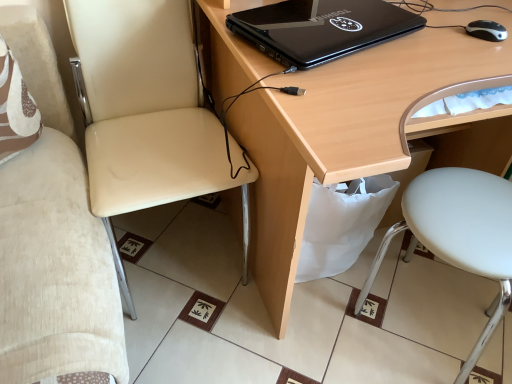
What are the coordinates of `black matte laptop at upper center` in the screenshot? It's located at (322, 29).

Where is `white matte stool at lower right, the 1th chair from the right`? The height and width of the screenshot is (384, 512). white matte stool at lower right, the 1th chair from the right is located at coordinates click(x=459, y=234).

Image resolution: width=512 pixels, height=384 pixels. I want to click on black plastic mouse at right, so click(486, 30).

You are a GUI agent. You are given a task and a screenshot of the screen. Output one action in this format:
    pyautogui.click(x=<x>, y=<y>)
    Task: Click on the black matte laptop at upper center
    
    Given the screenshot: What is the action you would take?
    pyautogui.click(x=322, y=29)

Considering the positions of objects black matte laptop at upper center and black plastic mouse at right in the image provided, who is more to the left, black matte laptop at upper center or black plastic mouse at right?

From the viewer's perspective, black matte laptop at upper center appears more on the left side.

Is black plastic mouse at right at the back of black matte laptop at upper center?

No, black matte laptop at upper center is not facing the opposite direction of black plastic mouse at right.

From the image's perspective, is black matte laptop at upper center located above or below black plastic mouse at right?

Clearly, from the image's perspective, black matte laptop at upper center is above black plastic mouse at right.

Looking at this image, between black matte laptop at upper center and black plastic mouse at right, which one is positioned behind?

black plastic mouse at right is behind.

In the scene shown: Is black matte laptop at upper center smaller than light wood desk at center?

Indeed, black matte laptop at upper center has a smaller size compared to light wood desk at center.

Is black matte laptop at upper center beside light wood desk at center?

They are not placed beside each other.

From a real-world perspective, is black matte laptop at upper center physically located above or below light wood desk at center?

black matte laptop at upper center is situated higher than light wood desk at center in the real world.

Is white matte stool at lower right, the 1th chair from the right, smaller than beige leather chair at left, which is the 2th chair in right-to-left order?

Yes.

What's the angular difference between white matte stool at lower right, which is the 2th chair from left to right, and beige leather chair at left, which is the first chair from left to right,'s facing directions?

There is a 3.69-degree angle between the facing directions of white matte stool at lower right, which is the 2th chair from left to right, and beige leather chair at left, which is the first chair from left to right.

From the image's perspective, is white matte stool at lower right, the 1th chair from the right, on beige leather chair at left, which is the first chair from left to right?

No, from the image's perspective, white matte stool at lower right, the 1th chair from the right, is not above beige leather chair at left, which is the first chair from left to right.

Is white matte stool at lower right, the 1th chair from the right, taller than beige leather chair at left, which is the 2th chair in right-to-left order?

No, white matte stool at lower right, the 1th chair from the right, is not taller than beige leather chair at left, which is the 2th chair in right-to-left order.

What are the coordinates of `desk in front of the black plastic mouse at right` in the screenshot? It's located at (361, 132).

Is light wood desk at center at the back of black plastic mouse at right?

Yes, black plastic mouse at right's orientation is away from light wood desk at center.

Is black plastic mouse at right inside the boundaries of light wood desk at center, or outside?

black plastic mouse at right can be found inside light wood desk at center.

Between light wood desk at center and black plastic mouse at right, which one has larger size?

light wood desk at center is bigger.

From a real-world perspective, between light wood desk at center and black plastic mouse at right, who is vertically lower?

In real-world perspective, light wood desk at center is lower.

Which is behind, light wood desk at center or black plastic mouse at right?

black plastic mouse at right.

From the image's perspective, would you say light wood desk at center is shown under black plastic mouse at right?

Yes, from the image's perspective, light wood desk at center is below black plastic mouse at right.

Is beige leather chair at left, which is the first chair from left to right, shorter than black matte laptop at upper center?

Incorrect, the height of beige leather chair at left, which is the first chair from left to right, does not fall short of that of black matte laptop at upper center.

From a real-world perspective, which object stands above the other?

black matte laptop at upper center.

Considering the positions of objects beige leather chair at left, which is the 2th chair in right-to-left order, and black matte laptop at upper center in the image provided, who is more to the right, beige leather chair at left, which is the 2th chair in right-to-left order, or black matte laptop at upper center?

Positioned to the right is black matte laptop at upper center.

From a real-world perspective, is white matte stool at lower right, which is the 2th chair from left to right, physically below light wood desk at center?

Yes, from a real-world perspective, white matte stool at lower right, which is the 2th chair from left to right, is below light wood desk at center.

Is white matte stool at lower right, which is the 2th chair from left to right, spatially inside light wood desk at center, or outside of it?

white matte stool at lower right, which is the 2th chair from left to right, is spatially positioned inside light wood desk at center.

From the image's perspective, is white matte stool at lower right, the 1th chair from the right, on top of light wood desk at center?

No.

Locate an element on the screen. Image resolution: width=512 pixels, height=384 pixels. the 2nd chair directly beneath the light wood desk at center (from a real-world perspective) is located at coordinates (459, 234).

The width and height of the screenshot is (512, 384). In the image, there is a black plastic mouse at right. Identify the location of laptop above it (from the image's perspective). (322, 29).

This screenshot has height=384, width=512. What are the coordinates of `desk below the black matte laptop at upper center (from a real-world perspective)` in the screenshot? It's located at (x=361, y=132).

Considering their positions, is beige leather chair at left, which is the first chair from left to right, positioned closer to black plastic mouse at right than white matte stool at lower right, the 1th chair from the right?

The object closer to black plastic mouse at right is white matte stool at lower right, the 1th chair from the right.

When comparing their distances from black plastic mouse at right, does black matte laptop at upper center or beige leather chair at left, which is the first chair from left to right, seem closer?

Based on the image, black matte laptop at upper center appears to be nearer to black plastic mouse at right.

Estimate the real-world distances between objects in this image. Which object is further from black matte laptop at upper center, beige leather chair at left, which is the first chair from left to right, or black plastic mouse at right?

beige leather chair at left, which is the first chair from left to right, is positioned further to the anchor black matte laptop at upper center.

Which object lies nearer to the anchor point light wood desk at center, white matte stool at lower right, which is the 2th chair from left to right, or black plastic mouse at right?

white matte stool at lower right, which is the 2th chair from left to right, lies closer to light wood desk at center than the other object.

When comparing their distances from beige leather chair at left, which is the 2th chair in right-to-left order, does white matte stool at lower right, which is the 2th chair from left to right, or light wood desk at center seem closer?

light wood desk at center is closer to beige leather chair at left, which is the 2th chair in right-to-left order.

Considering their positions, is light wood desk at center positioned further to white matte stool at lower right, the 1th chair from the right, than beige leather chair at left, which is the first chair from left to right?

beige leather chair at left, which is the first chair from left to right.

Considering their positions, is black plastic mouse at right positioned further to beige leather chair at left, which is the 2th chair in right-to-left order, than white matte stool at lower right, the 1th chair from the right?

black plastic mouse at right is further to beige leather chair at left, which is the 2th chair in right-to-left order.

From the picture: Based on their spatial positions, is black matte laptop at upper center or white matte stool at lower right, which is the 2th chair from left to right, further from light wood desk at center?

white matte stool at lower right, which is the 2th chair from left to right.

Find the location of a particular element. The image size is (512, 384). desk between black plastic mouse at right and white matte stool at lower right, the 1th chair from the right, from top to bottom is located at coordinates (361, 132).

Where is `laptop situated between beige leather chair at left, which is the 2th chair in right-to-left order, and white matte stool at lower right, the 1th chair from the right, from left to right`? This screenshot has height=384, width=512. laptop situated between beige leather chair at left, which is the 2th chair in right-to-left order, and white matte stool at lower right, the 1th chair from the right, from left to right is located at coordinates (322, 29).

Locate an element on the screen. laptop between light wood desk at center and black plastic mouse at right in the front-back direction is located at coordinates (322, 29).

Where is `desk between black matte laptop at upper center and white matte stool at lower right, which is the 2th chair from left to right, in the up-down direction`? This screenshot has height=384, width=512. desk between black matte laptop at upper center and white matte stool at lower right, which is the 2th chair from left to right, in the up-down direction is located at coordinates (361, 132).